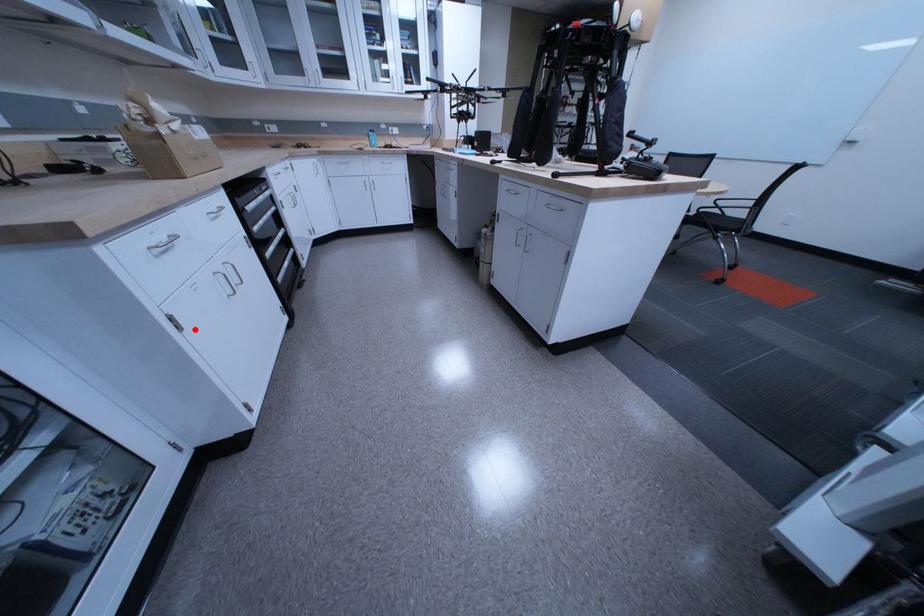
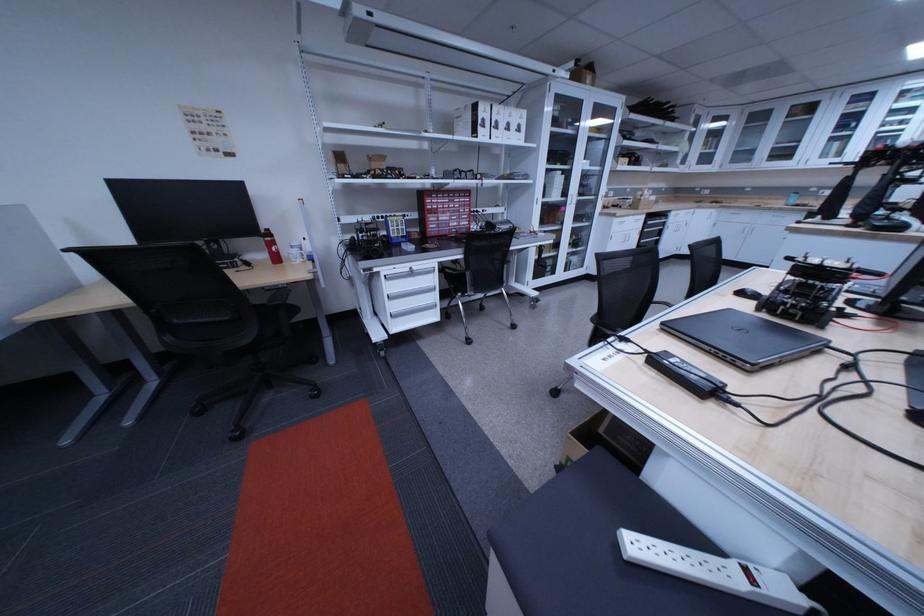
Question: I am providing you with two images of the same scene from different viewpoints. Given a red point in image1, look at the same physical point in image2. Is it:

Choices:
 (A) Closer to the viewpoint
 (B) Farther from the viewpoint

Answer: (A)